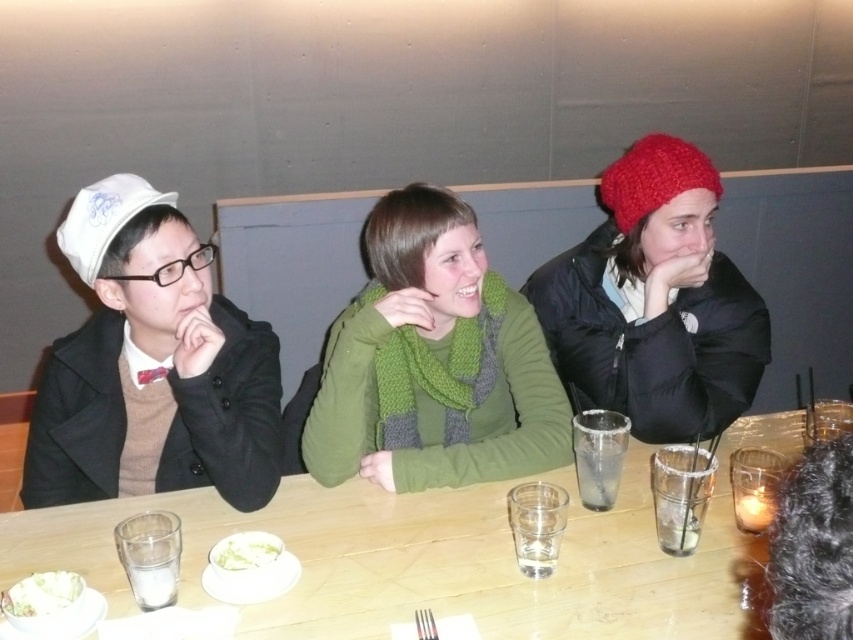
How far apart are wooden table at center and knitted red beanie at upper right?

wooden table at center is 32.97 inches from knitted red beanie at upper right.

Which is behind, point (198, 593) or point (691, 182)?

Point (691, 182)

What are the coordinates of `wooden table at center` in the screenshot? It's located at (440, 556).

Identify the location of wooden table at center. Image resolution: width=853 pixels, height=640 pixels. (440, 556).

How distant is wooden table at center from white creamy salad at lower left?

A distance of 18.98 inches exists between wooden table at center and white creamy salad at lower left.

Can you confirm if wooden table at center is positioned to the right of white creamy salad at lower left?

Correct, you'll find wooden table at center to the right of white creamy salad at lower left.

The image size is (853, 640). What do you see at coordinates (440, 556) in the screenshot?
I see `wooden table at center` at bounding box center [440, 556].

This screenshot has width=853, height=640. I want to click on wooden table at center, so click(x=440, y=556).

Between white matte hat at left and knitted red beanie at upper right, which one appears on the right side from the viewer's perspective?

knitted red beanie at upper right is more to the right.

Does white matte hat at left lie in front of knitted red beanie at upper right?

Yes, it is in front of knitted red beanie at upper right.

What do you see at coordinates (151, 365) in the screenshot?
I see `white matte hat at left` at bounding box center [151, 365].

Find the location of a particular element. The width and height of the screenshot is (853, 640). white matte hat at left is located at coordinates (151, 365).